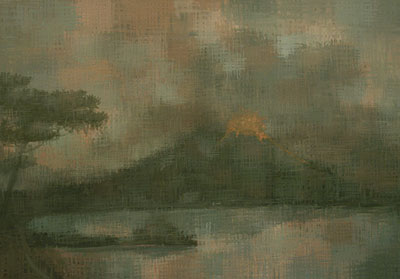
The width and height of the screenshot is (400, 279). I want to click on painting, so click(x=231, y=144).